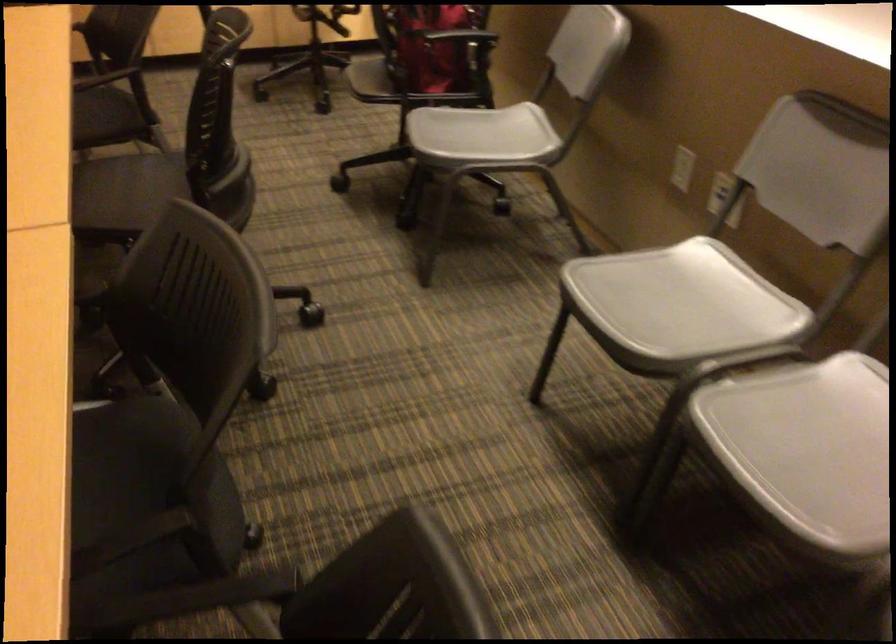
Find the location of `black chair armrest`. black chair armrest is located at coordinates (332, 592).